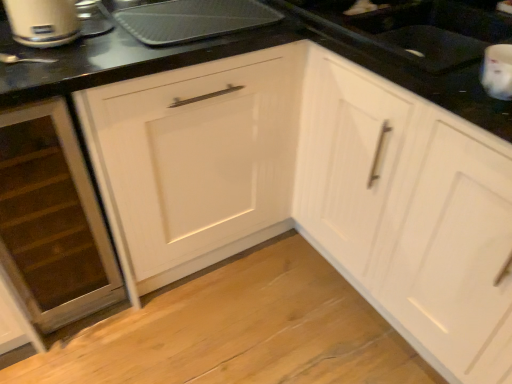
Question: From the image's perspective, is white glossy cabinet at center, which appears as the first cabinetry when viewed from the right, on wooden drawer at lower left, which is counted as the 1th cabinetry, starting from the left?

Choices:
 (A) no
 (B) yes

Answer: (B)

Question: Considering the relative sizes of white glossy cabinet at center, the 2th cabinetry viewed from the left, and wooden drawer at lower left, marked as the second cabinetry in a right-to-left arrangement, in the image provided, is white glossy cabinet at center, the 2th cabinetry viewed from the left, thinner than wooden drawer at lower left, marked as the second cabinetry in a right-to-left arrangement,?

Choices:
 (A) no
 (B) yes

Answer: (A)

Question: Is wooden drawer at lower left, which is counted as the 1th cabinetry, starting from the left, at the back of white glossy cabinet at center, which appears as the first cabinetry when viewed from the right?

Choices:
 (A) no
 (B) yes

Answer: (A)

Question: Is white glossy cabinet at center, the 2th cabinetry viewed from the left, to the left of wooden drawer at lower left, which is counted as the 1th cabinetry, starting from the left, from the viewer's perspective?

Choices:
 (A) yes
 (B) no

Answer: (B)

Question: Considering the relative positions of white glossy cabinet at center, which appears as the first cabinetry when viewed from the right, and wooden drawer at lower left, which is counted as the 1th cabinetry, starting from the left, in the image provided, is white glossy cabinet at center, which appears as the first cabinetry when viewed from the right, to the right of wooden drawer at lower left, which is counted as the 1th cabinetry, starting from the left, from the viewer's perspective?

Choices:
 (A) no
 (B) yes

Answer: (B)

Question: Considering the relative sizes of white glossy cabinet at center, which appears as the first cabinetry when viewed from the right, and wooden drawer at lower left, which is counted as the 1th cabinetry, starting from the left, in the image provided, is white glossy cabinet at center, which appears as the first cabinetry when viewed from the right, bigger than wooden drawer at lower left, which is counted as the 1th cabinetry, starting from the left,?

Choices:
 (A) no
 (B) yes

Answer: (B)

Question: Is metallic silver tray at upper center at the right side of matte silver toaster at upper left?

Choices:
 (A) yes
 (B) no

Answer: (A)

Question: Is metallic silver tray at upper center positioned far away from matte silver toaster at upper left?

Choices:
 (A) yes
 (B) no

Answer: (B)

Question: From a real-world perspective, is metallic silver tray at upper center under matte silver toaster at upper left?

Choices:
 (A) yes
 (B) no

Answer: (A)

Question: Is metallic silver tray at upper center looking in the opposite direction of matte silver toaster at upper left?

Choices:
 (A) yes
 (B) no

Answer: (B)

Question: From the image's perspective, is metallic silver tray at upper center on matte silver toaster at upper left?

Choices:
 (A) no
 (B) yes

Answer: (B)

Question: Is the surface of metallic silver tray at upper center in direct contact with matte silver toaster at upper left?

Choices:
 (A) yes
 (B) no

Answer: (B)

Question: Would you say matte silver toaster at upper left is a long distance from metallic silver tray at upper center?

Choices:
 (A) yes
 (B) no

Answer: (B)